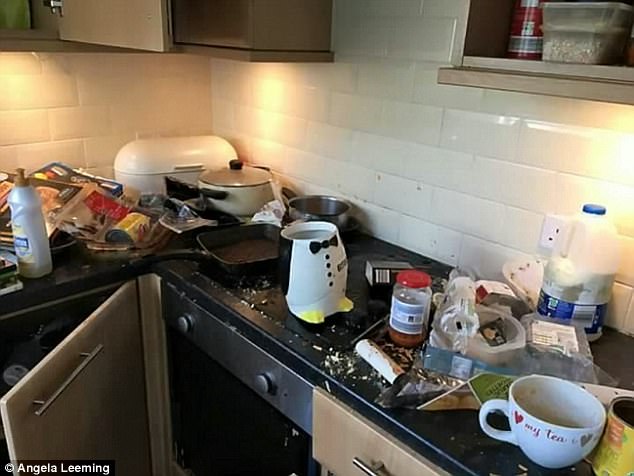
Find the location of a particular element. pot is located at coordinates (335, 209).